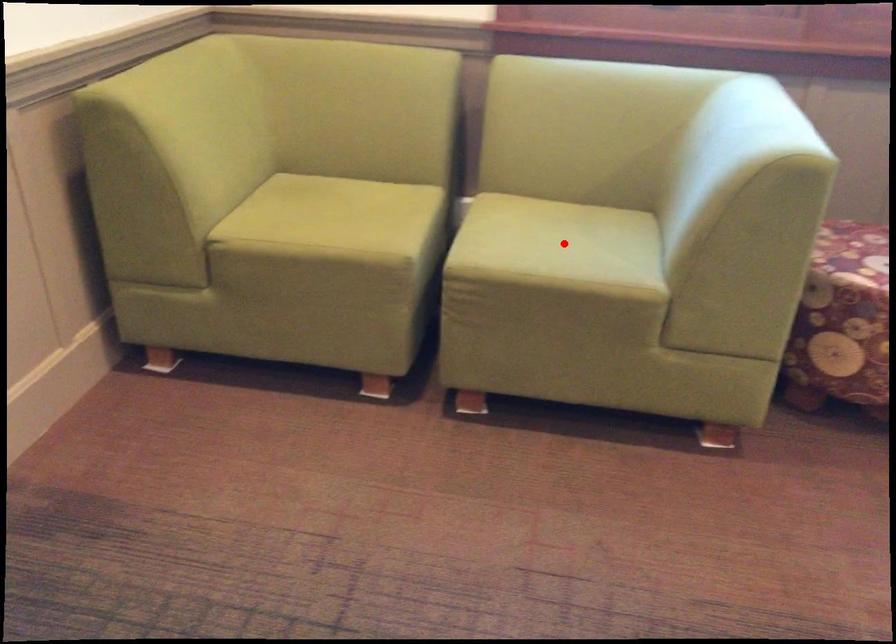
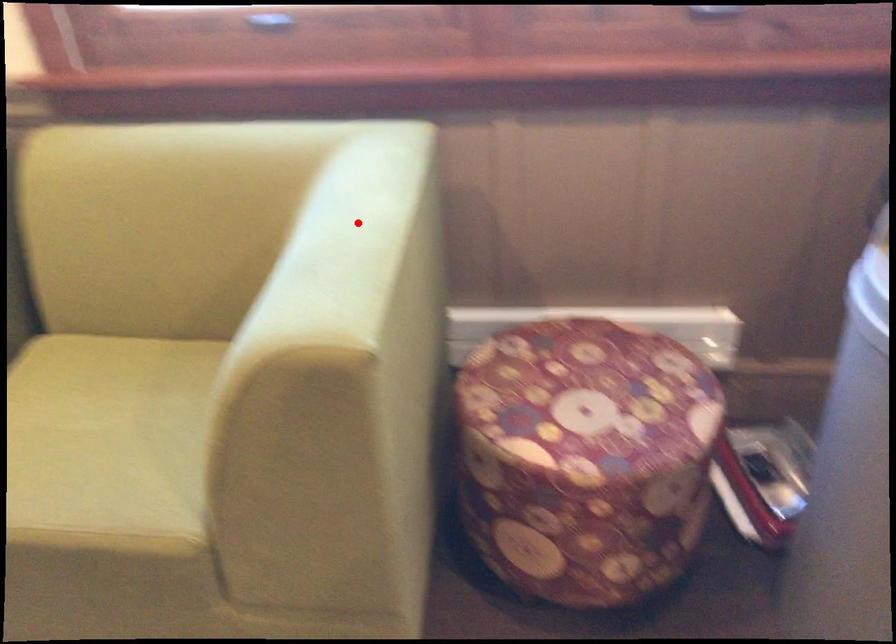
I am providing you with two images of the same scene from different viewpoints. A red point is marked on the first image and another point is marked on the second image. Is the red point in image1 aligned with the point shown in image2?

No